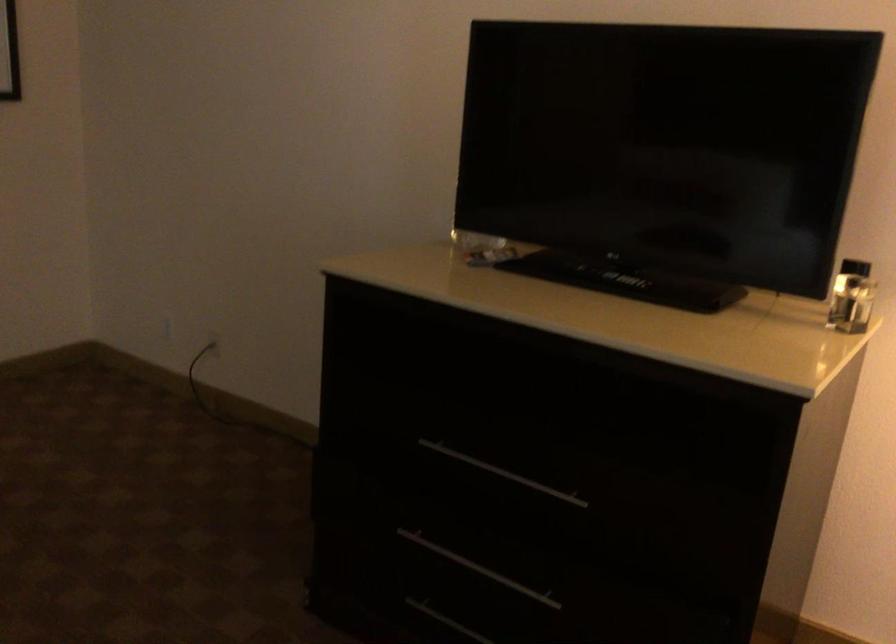
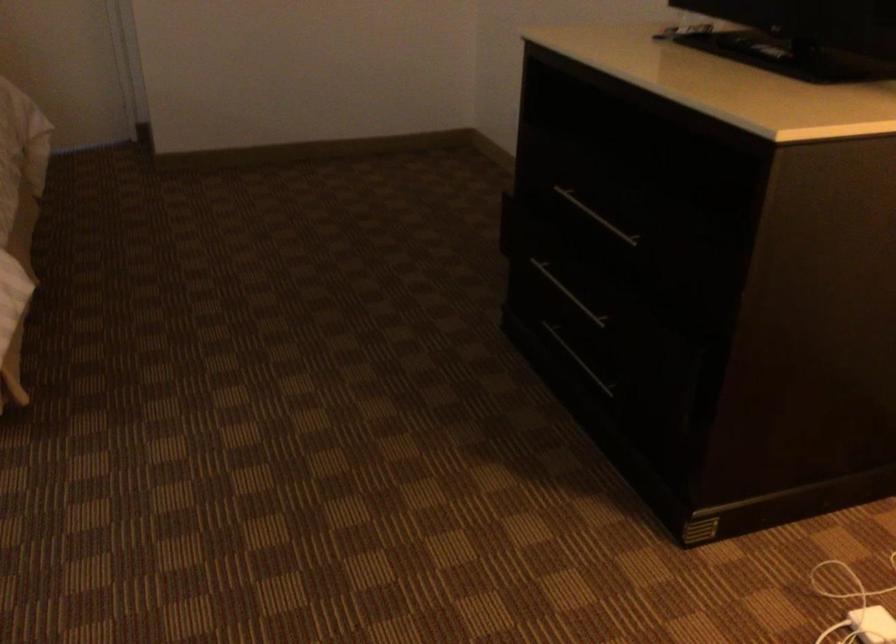
Where in the second image is the point corresponding to [497,475] from the first image?

(596, 216)